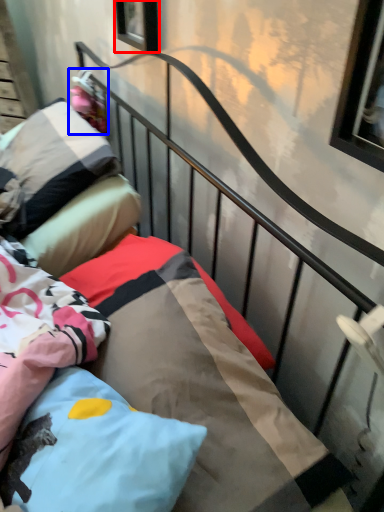
Question: Which object appears farthest to the camera in this image, window (highlighted by a red box) or doll (highlighted by a blue box)?

Choices:
 (A) window
 (B) doll

Answer: (B)